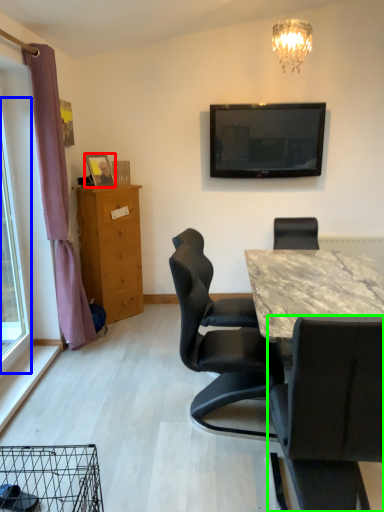
Question: Which object is the farthest from picture frame (highlighted by a red box)? Choose among these: glass door (highlighted by a blue box) or chair (highlighted by a green box).

Choices:
 (A) glass door
 (B) chair

Answer: (B)